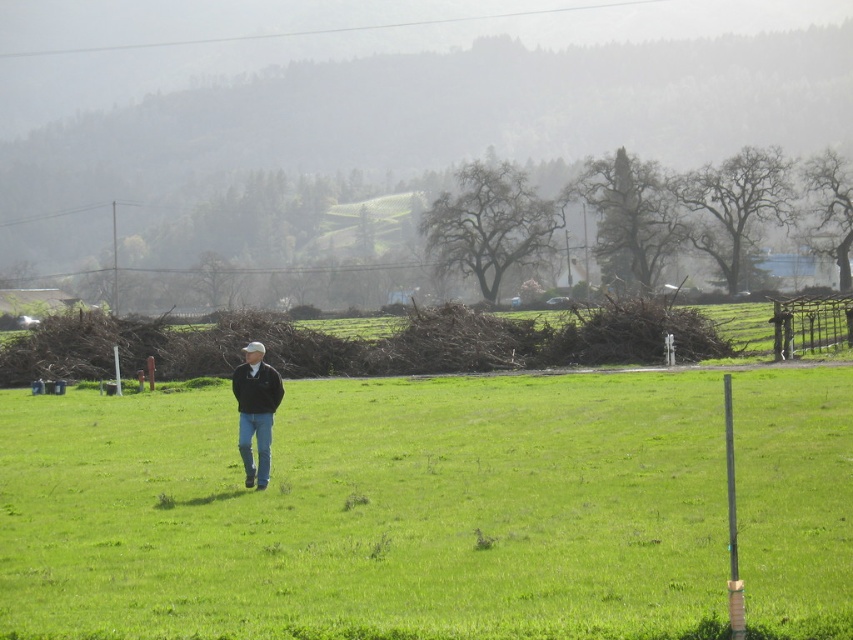
Can you confirm if green grass at center is bigger than dark blue jeans at center?

Yes.

Who is positioned more to the left, green grass at center or dark blue jeans at center?

From the viewer's perspective, dark blue jeans at center appears more on the left side.

Image resolution: width=853 pixels, height=640 pixels. I want to click on green grass at center, so click(369, 509).